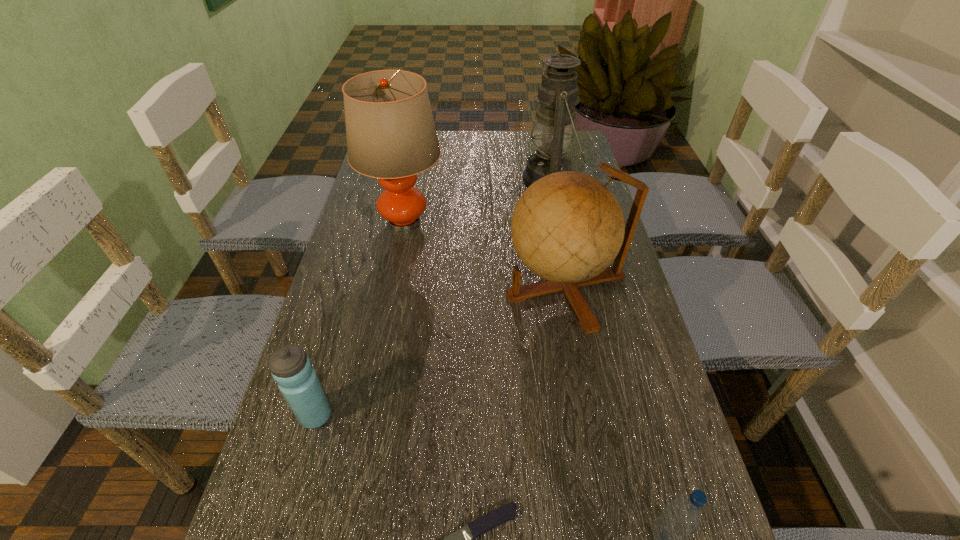
I want to click on lamp, so click(391, 135).

Where is `oil lamp`? oil lamp is located at coordinates point(558,92).

Locate an element on the screen. Image resolution: width=960 pixels, height=540 pixels. globe is located at coordinates (567, 227).

Find the location of a particular element. the third nearest object is located at coordinates (291, 368).

Locate an element on the screen. The width and height of the screenshot is (960, 540). the taller water bottle is located at coordinates tap(291, 368).

In order to click on vacant area situated 0.320m on the back of the lamp in this screenshot , I will do `click(420, 147)`.

Where is `free spot located on the back of the oil lamp`? The width and height of the screenshot is (960, 540). free spot located on the back of the oil lamp is located at coordinates (545, 151).

At what (x,y) coordinates should I click in order to perform the action: click on vacant space located on the surface of the globe. Please return your answer as a coordinate pair (x, y). The image size is (960, 540). Looking at the image, I should click on (481, 286).

This screenshot has height=540, width=960. In order to click on vacant space located 0.250m on the surface of the globe in this screenshot , I will do `click(405, 286)`.

Locate an element on the screen. This screenshot has height=540, width=960. free point located on the surface of the globe is located at coordinates tap(381, 286).